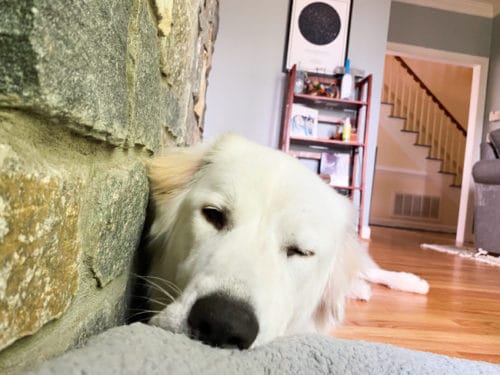
The height and width of the screenshot is (375, 500). What are the coordinates of `black circle in painting` in the screenshot? It's located at (321, 19).